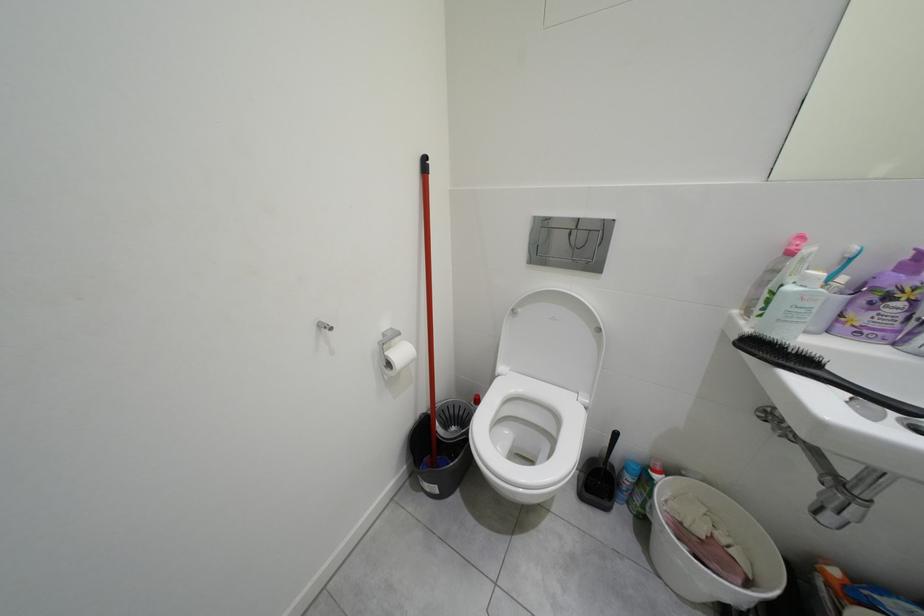
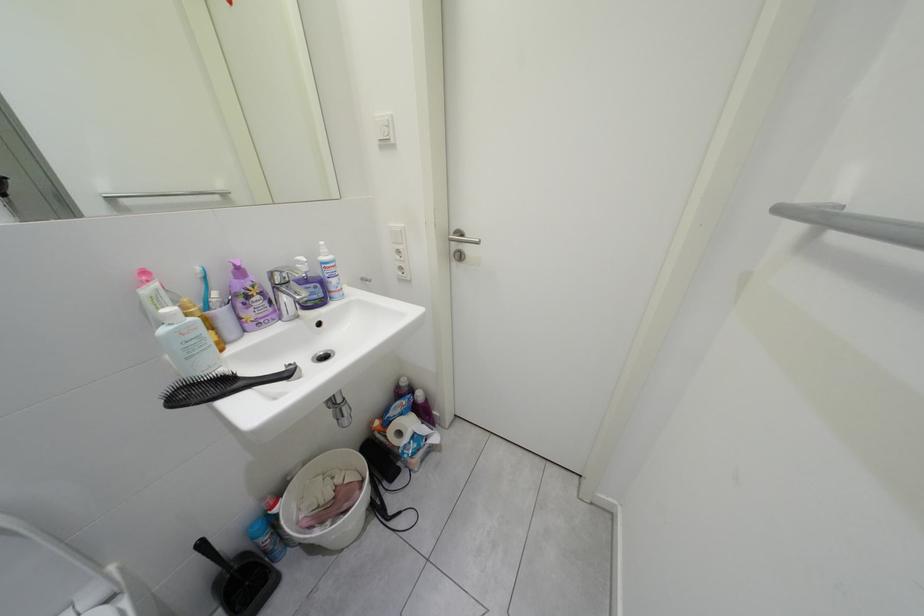
How did the camera likely rotate?

The rotation direction of the camera is right-down.